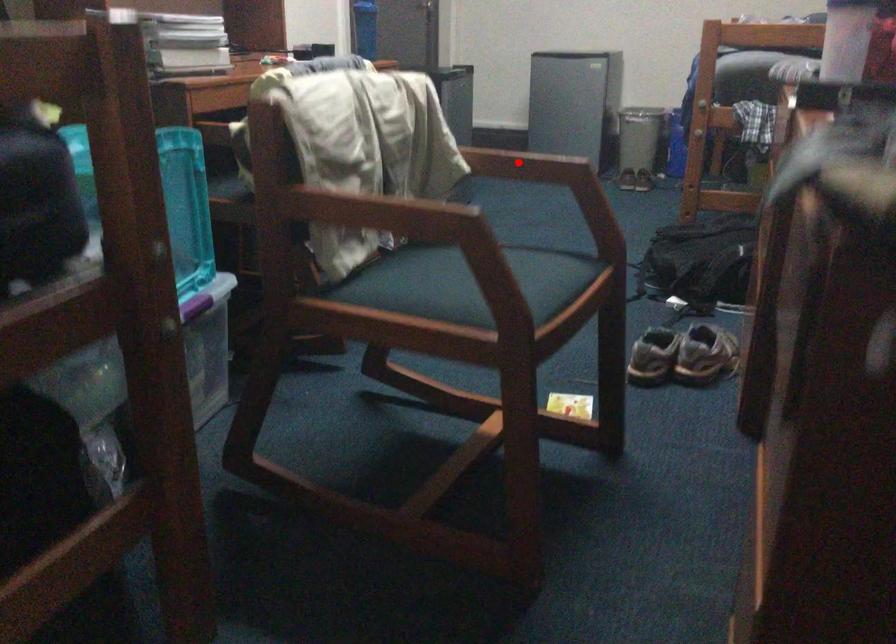
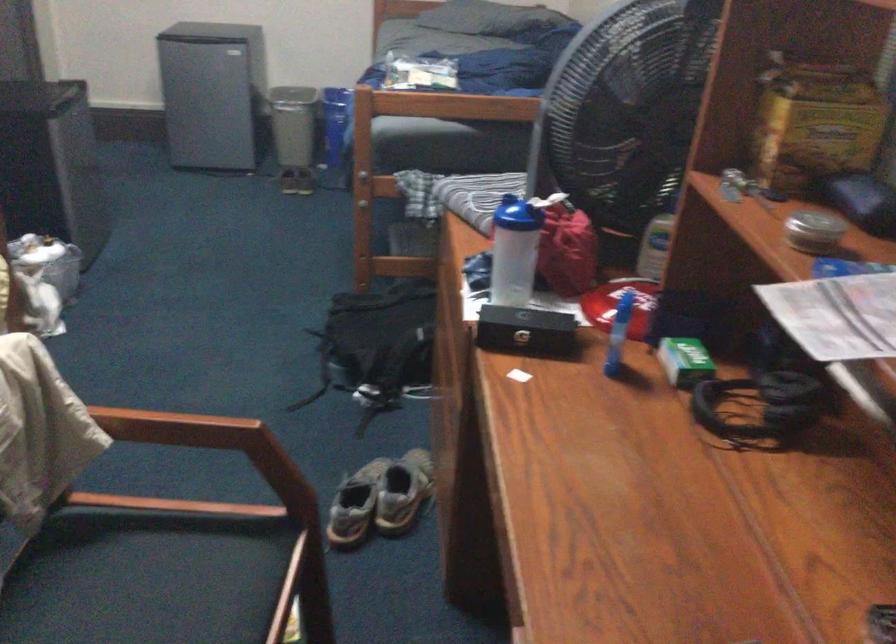
The point at the highlighted location is marked in the first image. Where is the corresponding point in the second image?

(176, 428)